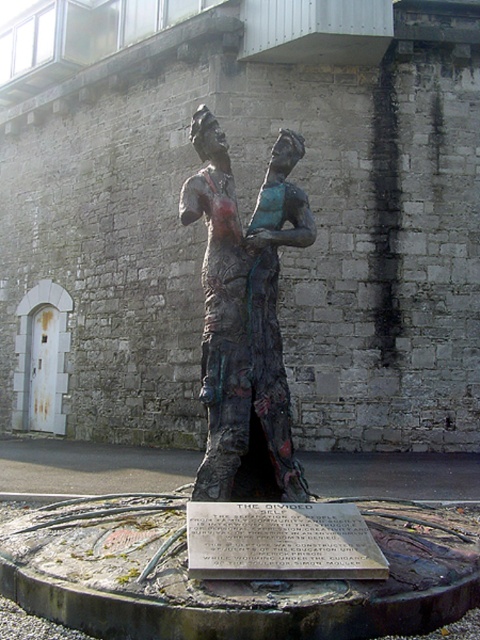
You are standing in front of the sculpture and want to touch the point at coordinate point (x=208, y=445). Can you reach it without moving your position?

The point at coordinate point (x=208, y=445) is 4.23 meters away from you, so you cannot reach it without moving closer.

You are an art student who wants to sketch the bronze sculpture in the image. You notice the bronze textured figures at center and the bronze plaque at center. Which one should you focus on first if you want to draw the larger object?

The bronze textured figures at center is bigger than the bronze plaque at center, so you should focus on the bronze textured figures at center first.